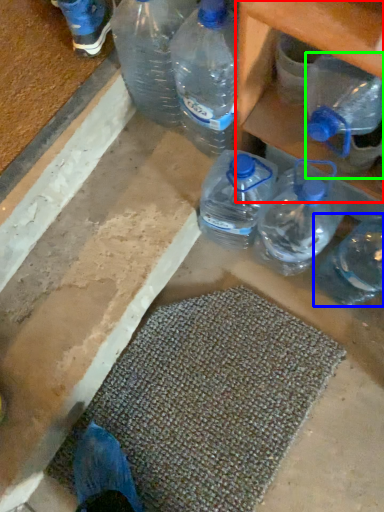
Question: Based on their relative distances, which object is farther from shelf (highlighted by a red box)? Choose from bottle (highlighted by a blue box) and bottle (highlighted by a green box).

Choices:
 (A) bottle
 (B) bottle

Answer: (A)